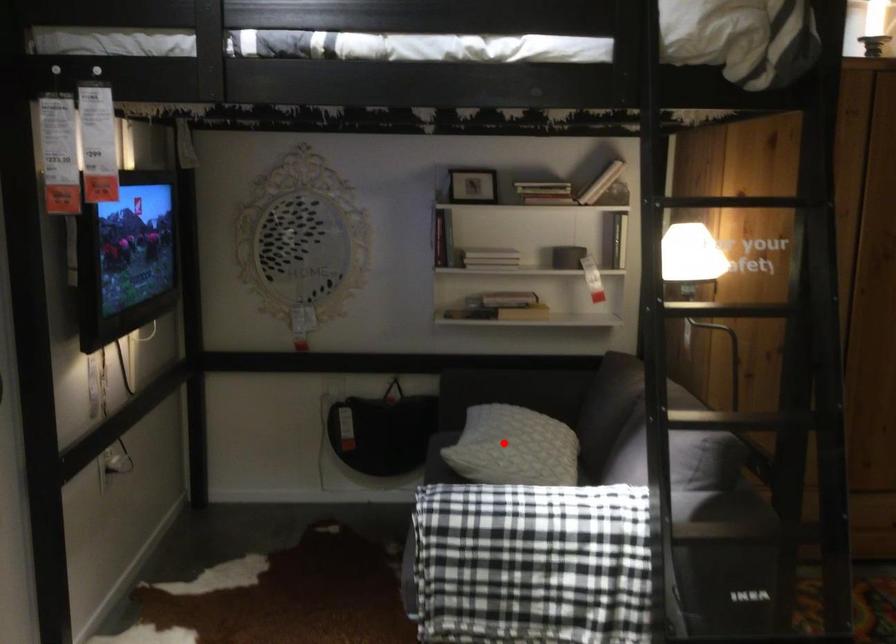
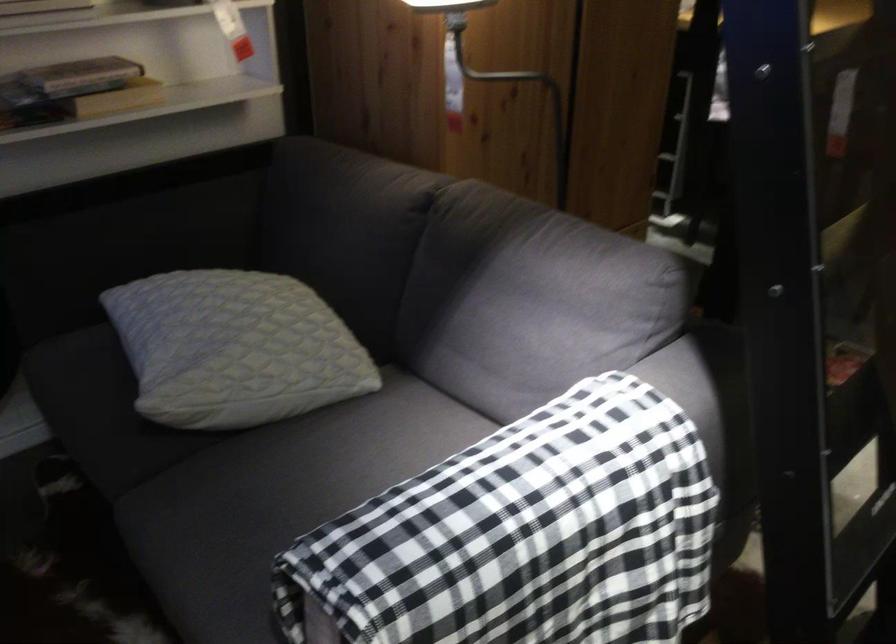
Question: I am providing you with two images of the same scene from different viewpoints. In image1, a red point is highlighted. Considering the same 3D point in image2, which of the following is correct?

Choices:
 (A) It is closer
 (B) It is farther

Answer: (A)